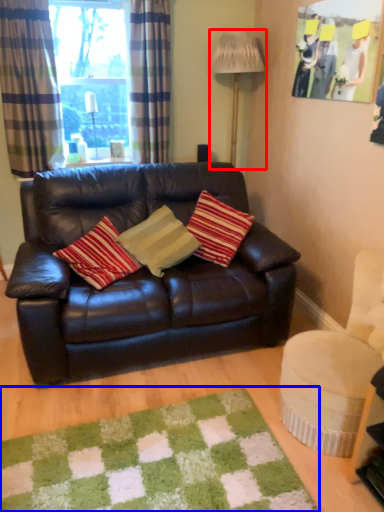
Question: Among these objects, which one is nearest to the camera, lamp (highlighted by a red box) or mat (highlighted by a blue box)?

Choices:
 (A) lamp
 (B) mat

Answer: (B)